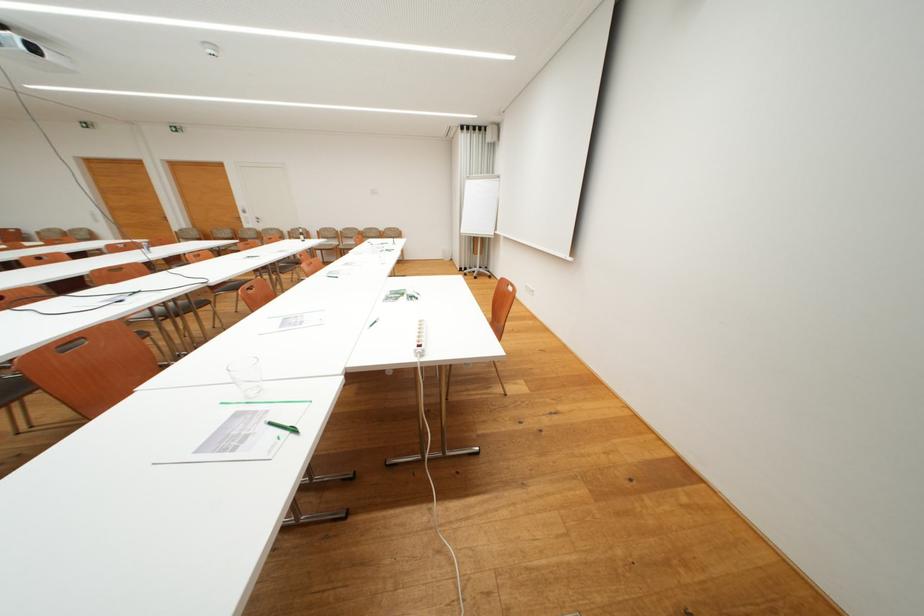
Find where to turn the white door handle. Please return your answer as a coordinate pair (x, y).

(257, 219)